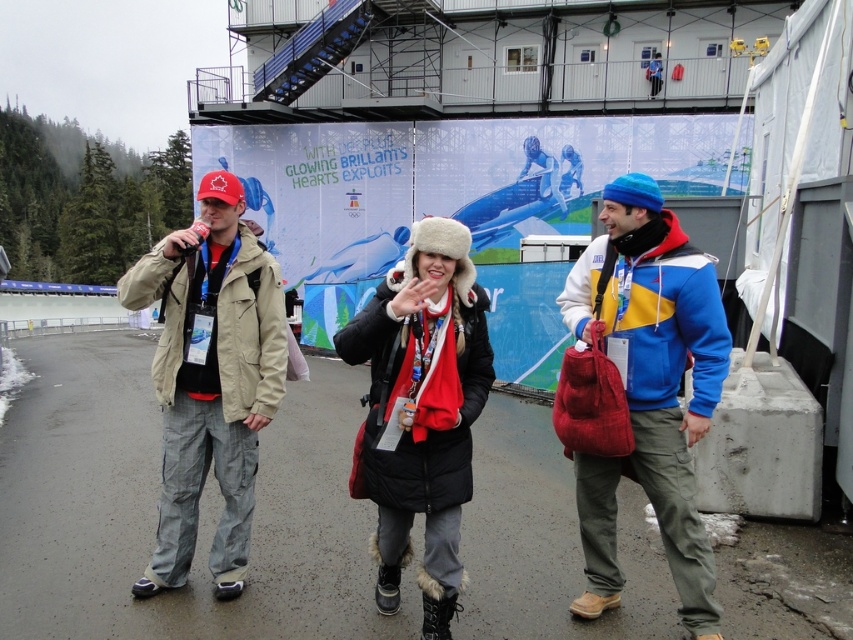
Is the position of blue fleece jacket at center more distant than that of matte khaki jacket at center?

No, blue fleece jacket at center is closer to the viewer.

This screenshot has height=640, width=853. Describe the element at coordinates (648, 388) in the screenshot. I see `blue fleece jacket at center` at that location.

The image size is (853, 640). What are the coordinates of `blue fleece jacket at center` in the screenshot? It's located at (648, 388).

Between point (636, 250) and point (390, 550), which one is positioned in front?

Point (636, 250) is more forward.

Who is positioned more to the left, blue fleece jacket at center or black fur-lined coat at center?

black fur-lined coat at center is more to the left.

Between point (682, 500) and point (467, 280), which one is positioned in front?

Point (467, 280) is more forward.

The image size is (853, 640). In order to click on blue fleece jacket at center in this screenshot , I will do `click(648, 388)`.

From the picture: Can you confirm if matte khaki jacket at center is positioned below black fur-lined coat at center?

Actually, matte khaki jacket at center is above black fur-lined coat at center.

Which is more to the right, matte khaki jacket at center or black fur-lined coat at center?

black fur-lined coat at center is more to the right.

Where is `matte khaki jacket at center`? This screenshot has width=853, height=640. matte khaki jacket at center is located at coordinates (210, 378).